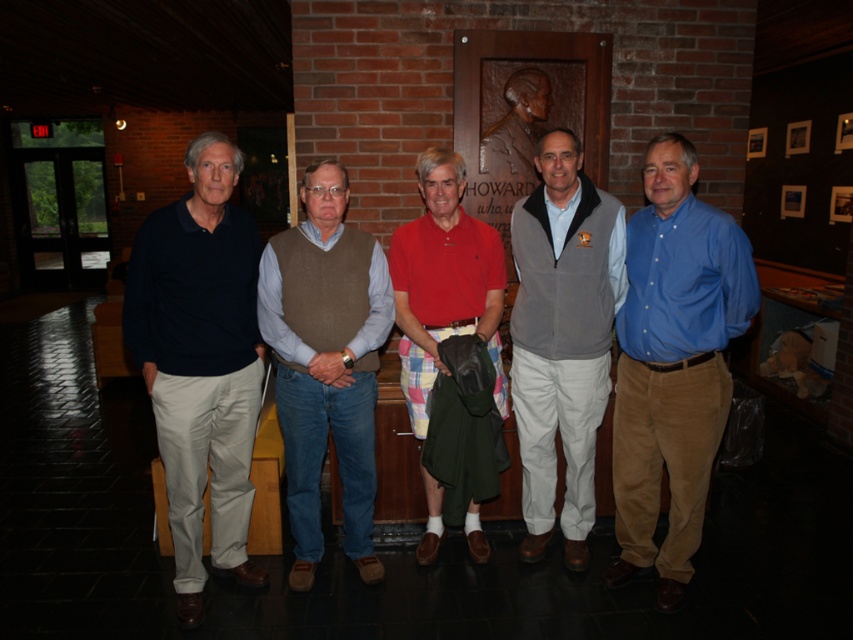
You are a photographer standing in front of the group. You need to capture a photo where both the dark blue cotton polo shirt at left and the brown wool vest at center are clearly visible. Considering their heights, which person should you focus on to ensure both are in frame?

The dark blue cotton polo shirt at left is taller than the brown wool vest at center, so focusing on the taller individual at the left will ensure both are in frame as the shorter person at center will naturally be included within the same shot.

You are trying to locate the exact position of the point marked at coordinates (672, 364) in the image. Based on the scene description, can you determine which object this point is located on?

The point at coordinates (672, 364) is located on the blue corduroy pants at right.

You are a photographer setting up a shoot in this hallway. You need to place a small tripod between the blue corduroy pants at right and the matte bronze bust at center. Based on their positions, which object should the tripod be closer to?

The blue corduroy pants at right is positioned under the matte bronze bust at center, so the tripod should be placed closer to the blue corduroy pants at right to avoid blocking the bust.